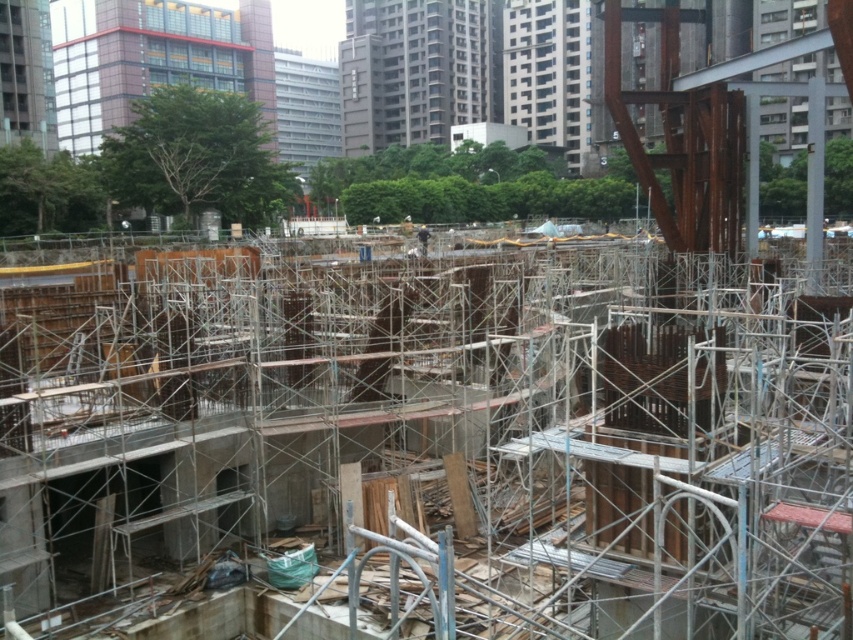
You are a safety inspector at the construction site. You need to ensure that the dark blue uniform at center is visible to workers on the metal scaffolding at center. Given that the scaffolding is wider than the uniform, is there enough space between them for the uniform to be clearly seen from the scaffolding?

The metal scaffolding at center is wider than the dark blue uniform at center, so there is sufficient space between them for the uniform to be clearly visible from the scaffolding.

You are a construction worker standing at the entrance of the construction site. You need to reach the metal scaffolding at center to secure some loose planks. Given your current position at point A, which is at coordinates 0.3, 0.3, can you estimate the direction you should move to reach the scaffolding?

The metal scaffolding at center is located at point [440,442]. From your current position at [254,192], you should move northeast to reach it.